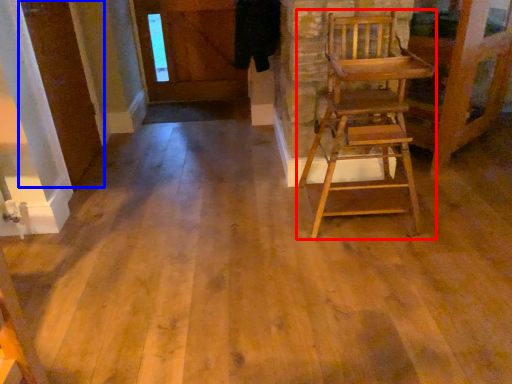
Question: Which point is closer to the camera, chair (highlighted by a red box) or door (highlighted by a blue box)?

Choices:
 (A) chair
 (B) door

Answer: (A)